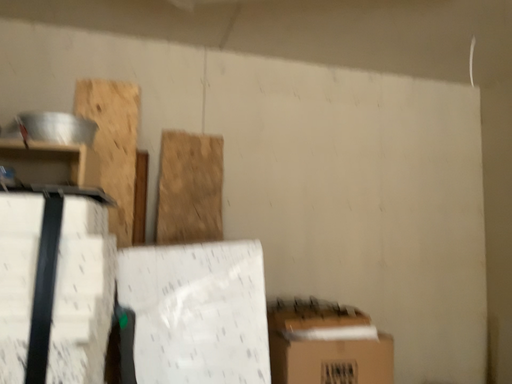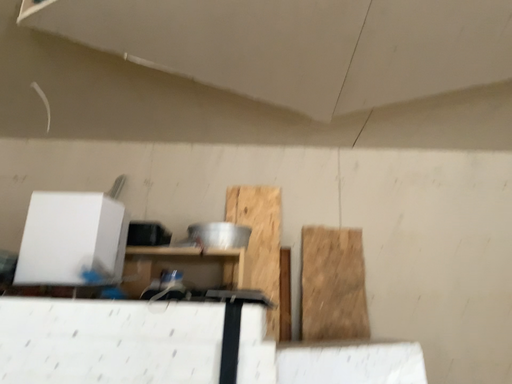
Question: Which way did the camera rotate in the video?

Choices:
 (A) rotated right
 (B) rotated left

Answer: (B)